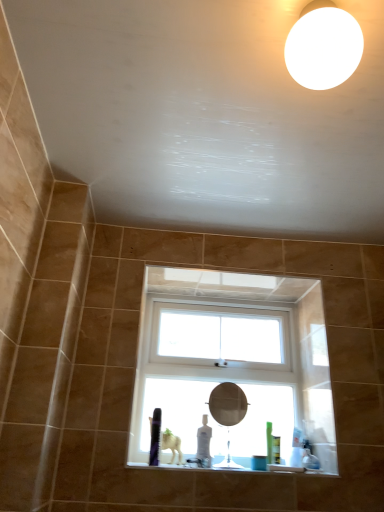
Question: Is white plastic window at center oriented towards matte silver mirror at center?

Choices:
 (A) no
 (B) yes

Answer: (B)

Question: Considering the relative sizes of white plastic window at center and matte silver mirror at center in the image provided, is white plastic window at center taller than matte silver mirror at center?

Choices:
 (A) yes
 (B) no

Answer: (A)

Question: Is white plastic window at center smaller than matte silver mirror at center?

Choices:
 (A) no
 (B) yes

Answer: (A)

Question: Is white plastic window at center not inside matte silver mirror at center?

Choices:
 (A) yes
 (B) no

Answer: (A)

Question: Can you confirm if white plastic window at center is shorter than matte silver mirror at center?

Choices:
 (A) no
 (B) yes

Answer: (A)

Question: Choose the correct answer: Is white plastic window at center inside white matte light fixture at upper right or outside it?

Choices:
 (A) outside
 (B) inside

Answer: (A)

Question: From a real-world perspective, is white plastic window at center positioned above or below white matte light fixture at upper right?

Choices:
 (A) above
 (B) below

Answer: (B)

Question: Is white plastic window at center wider or thinner than white matte light fixture at upper right?

Choices:
 (A) wide
 (B) thin

Answer: (B)

Question: Considering their positions, is white plastic window at center located in front of or behind white matte light fixture at upper right?

Choices:
 (A) behind
 (B) front

Answer: (A)

Question: Is white plastic window at center wider or thinner than matte silver mirror at center?

Choices:
 (A) wide
 (B) thin

Answer: (A)

Question: Relative to matte silver mirror at center, is white plastic window at center in front or behind?

Choices:
 (A) behind
 (B) front

Answer: (A)

Question: Looking at the image, does white plastic window at center seem bigger or smaller compared to matte silver mirror at center?

Choices:
 (A) big
 (B) small

Answer: (A)

Question: From a real-world perspective, relative to matte silver mirror at center, is white plastic window at center vertically above or below?

Choices:
 (A) below
 (B) above

Answer: (B)

Question: Considering the positions of white matte light fixture at upper right and white plastic window at center in the image, is white matte light fixture at upper right wider or thinner than white plastic window at center?

Choices:
 (A) wide
 (B) thin

Answer: (A)

Question: From a real-world perspective, relative to white plastic window at center, is white matte light fixture at upper right vertically above or below?

Choices:
 (A) below
 (B) above

Answer: (B)